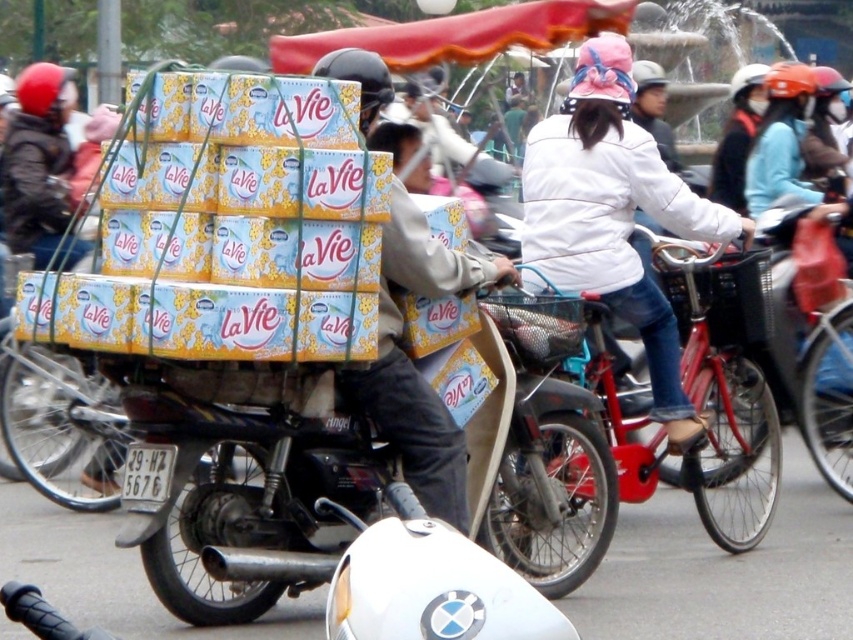
You are a pedestrian standing on the sidewalk. You see the metallic silver motorcycle at center and the white matte jacket at center. Which object is closer to you?

The metallic silver motorcycle at center is closer to you because it is in front of the white matte jacket at center.

You are a delivery person who needs to locate your colleague wearing a white matte jacket at center. Based on the scene description, can you determine the exact coordinates where your colleague is standing?

The white matte jacket at center is located at coordinates point (614, 216).